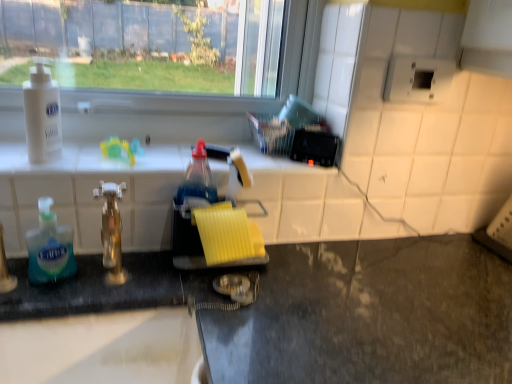
Locate an element on the screen. vacant area that lies to the right of translucent plastic soap dispenser at left, the 2th bottle positioned from the top is located at coordinates (123, 268).